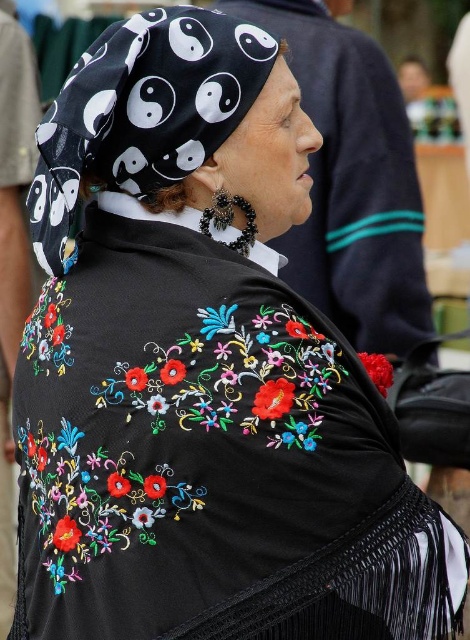
Question: In this image, where is black embroidered poncho at center located relative to black printed fabric headscarf at upper left?

Choices:
 (A) below
 (B) above

Answer: (B)

Question: Which point appears closest to the camera in this image?

Choices:
 (A) (195, 108)
 (B) (428, 300)

Answer: (A)

Question: Can you confirm if black embroidered poncho at center is smaller than black printed fabric headscarf at upper left?

Choices:
 (A) no
 (B) yes

Answer: (A)

Question: Does black embroidered poncho at center appear on the right side of black printed fabric headscarf at upper left?

Choices:
 (A) yes
 (B) no

Answer: (A)